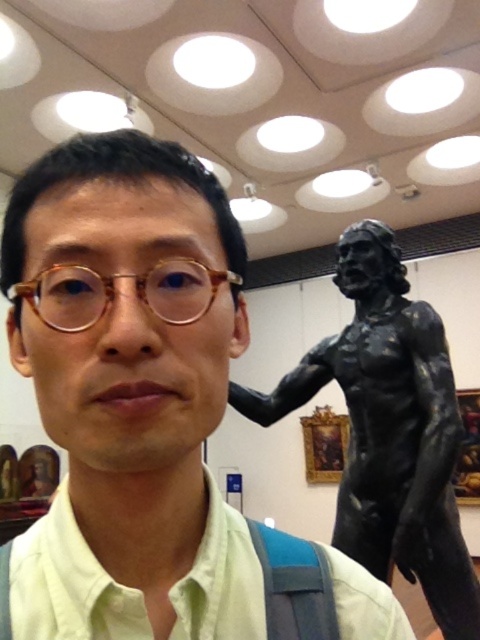
You are an interior designer planning to place a new sofa in the museum. You need to ensure it doesn not block the view of the light green cotton shirt at center. Given the black bronze statue at right is wider than the shirt, which object should you consider its width when deciding the sofa placement?

Since the black bronze statue at right is wider than the light green cotton shirt at center, you should consider the width of the black bronze statue at right to ensure the sofa placement doesn not block the view of the shirt.

You are an interior designer planning to place a new sofa in this room. The sofa will be positioned where the light green cotton shirt at center is currently located. Considering the space occupied by the matte black statue at right, will the statue need to be moved to accommodate the sofa?

The matte black statue at right occupies less space than the light green cotton shirt at center. Since the statue takes up less space, it may not need to be moved, but the exact decision depends on the sofa size and whether the shirt area has enough space. However, based on the given information, the statue itself doesn not require relocation due to its smaller footprint.